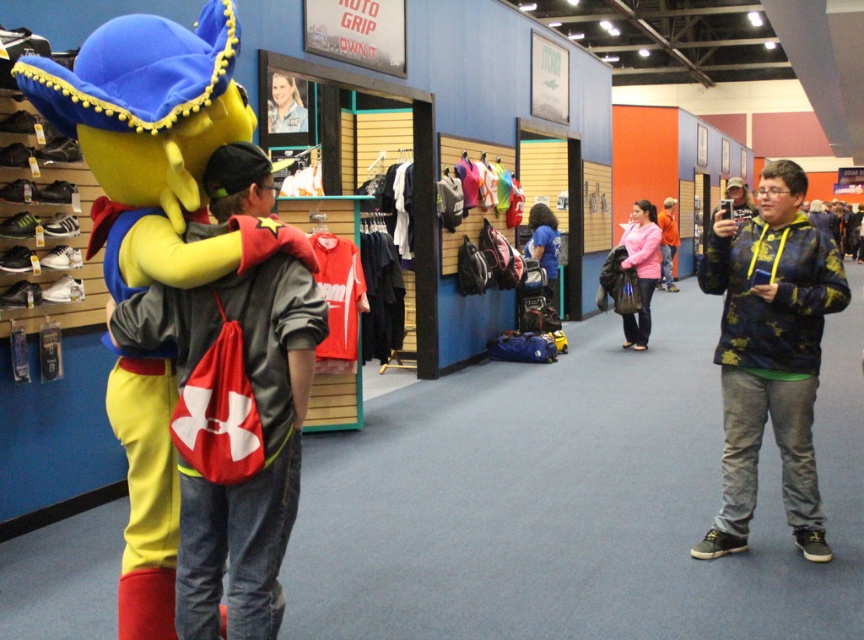
Is matte red jersey at center shorter than smooth skin portrait at upper center?

No, matte red jersey at center is not shorter than smooth skin portrait at upper center.

Where is `matte red jersey at center`? The width and height of the screenshot is (864, 640). matte red jersey at center is located at coordinates (340, 292).

The width and height of the screenshot is (864, 640). What do you see at coordinates (284, 106) in the screenshot? I see `smooth skin portrait at upper center` at bounding box center [284, 106].

Can you confirm if smooth skin portrait at upper center is wider than orange matte jacket at center?

No, smooth skin portrait at upper center is not wider than orange matte jacket at center.

Who is more distant from viewer, (306, 124) or (659, 284)?

Point (659, 284)

Find the location of a particular element. smooth skin portrait at upper center is located at coordinates (284, 106).

Is floral-patterned hoodie at right to the left of matte red jersey at center from the viewer's perspective?

Incorrect, floral-patterned hoodie at right is not on the left side of matte red jersey at center.

Is floral-patterned hoodie at right wider than matte red jersey at center?

Correct, the width of floral-patterned hoodie at right exceeds that of matte red jersey at center.

The image size is (864, 640). I want to click on floral-patterned hoodie at right, so click(770, 353).